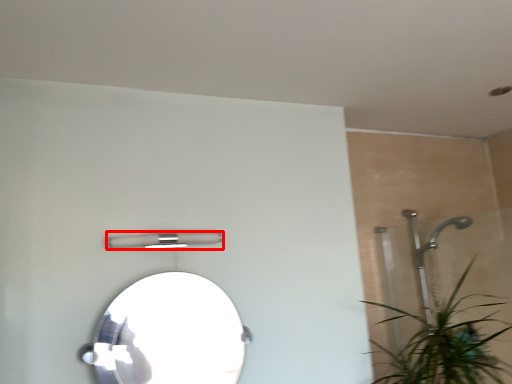
Question: From the image's perspective, where is light fixture (annotated by the red box) located relative to mirror?

Choices:
 (A) below
 (B) above

Answer: (B)